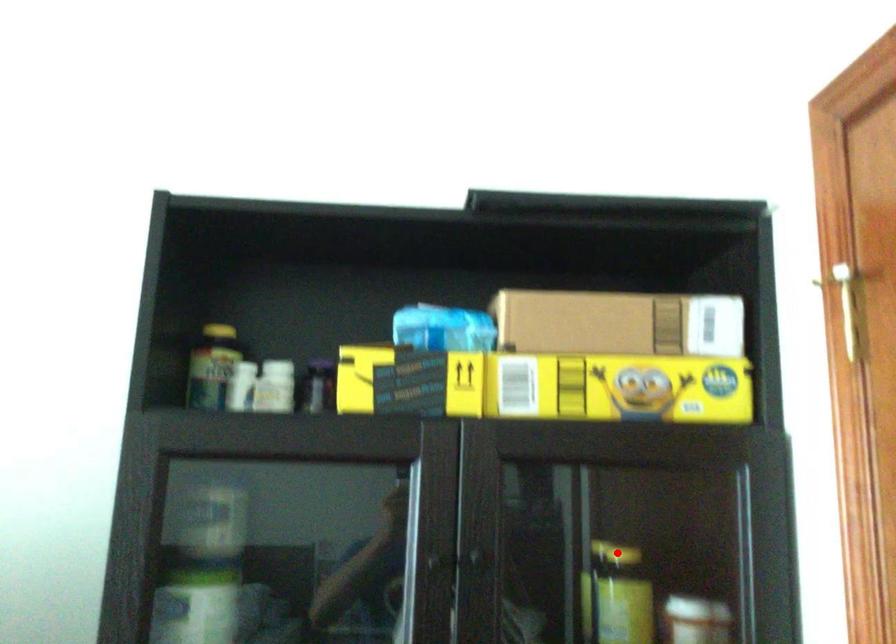
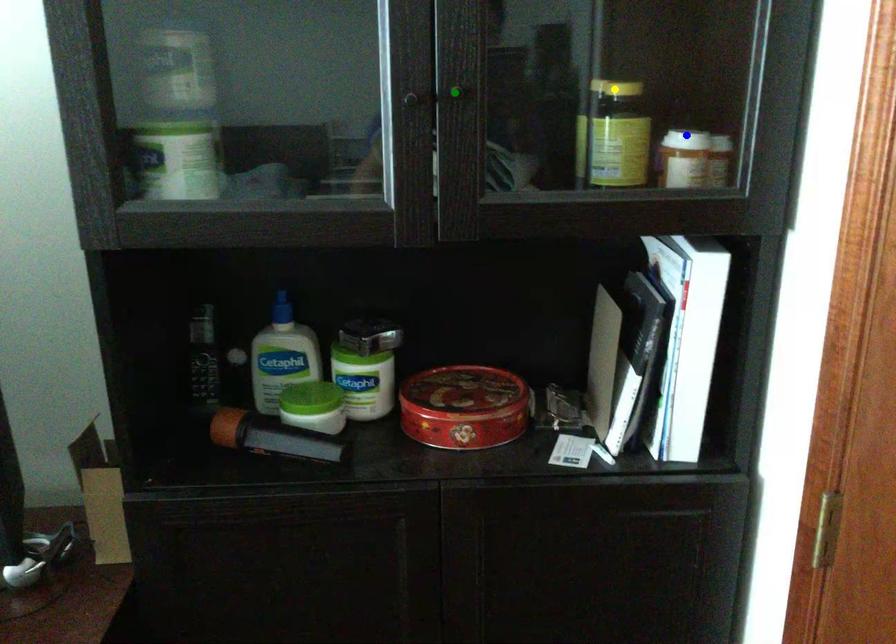
Question: I am providing you with two images of the same scene from different viewpoints. A red point is marked on the first image. You are given multiple points on the second image. Which point in image 2 is actually the same real-world point as the red point in image 1?

Choices:
 (A) yellow point
 (B) green point
 (C) blue point

Answer: (A)